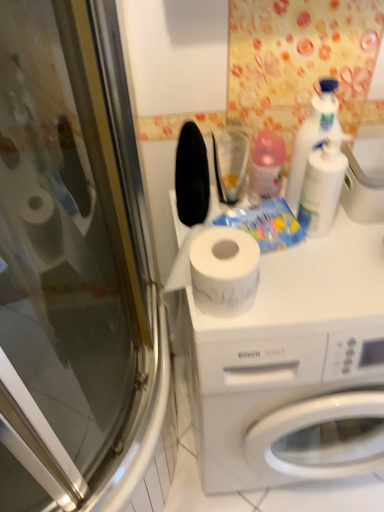
This screenshot has width=384, height=512. What are the coordinates of `vacant region in front of white plastic bottle at upper right, the second cleaning product viewed from the left` in the screenshot? It's located at (319, 280).